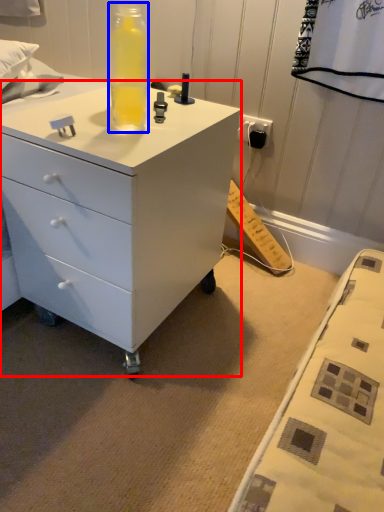
Question: Among these objects, which one is farthest to the camera, chest of drawers (highlighted by a red box) or bottle (highlighted by a blue box)?

Choices:
 (A) chest of drawers
 (B) bottle

Answer: (B)